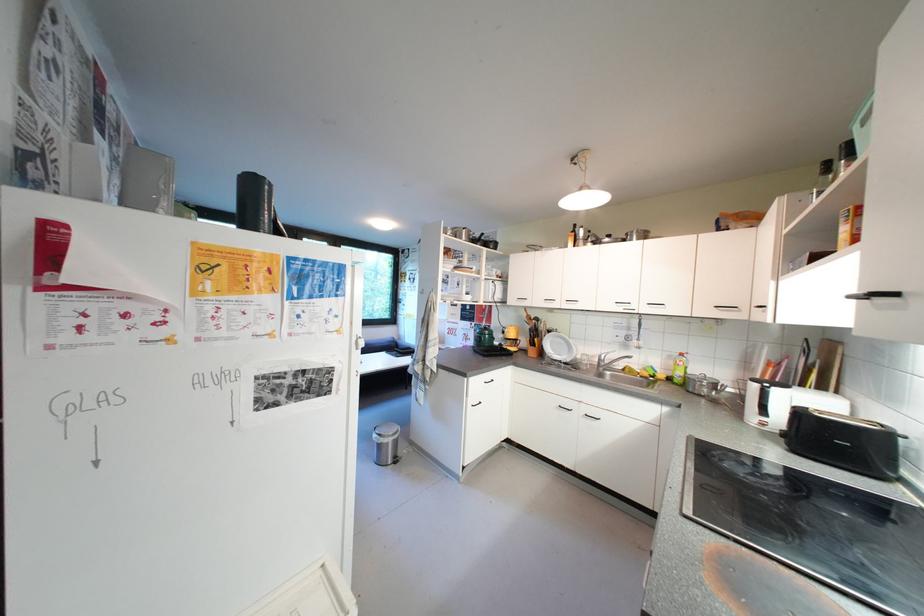
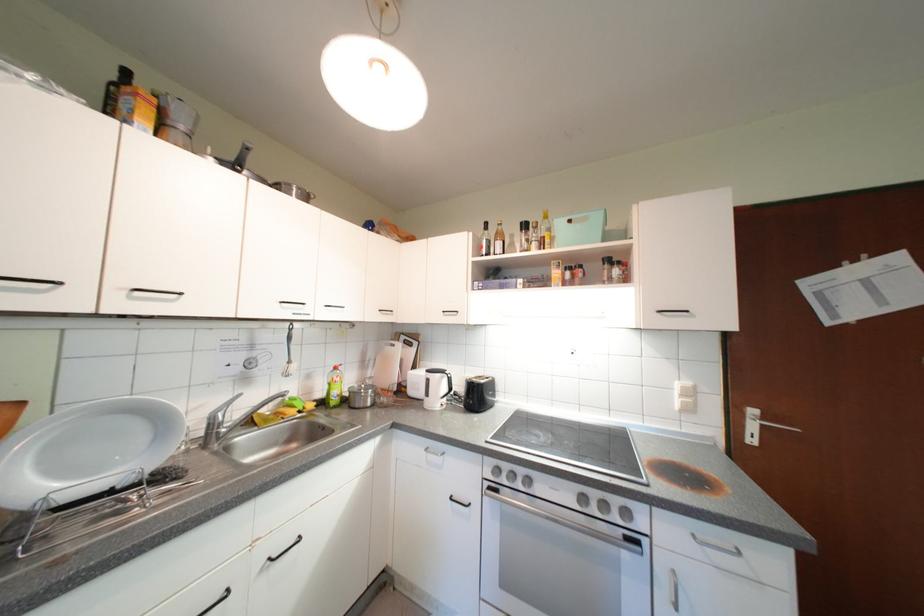
Find the pixel in the second image that matches [608,359] in the first image.

(220, 419)